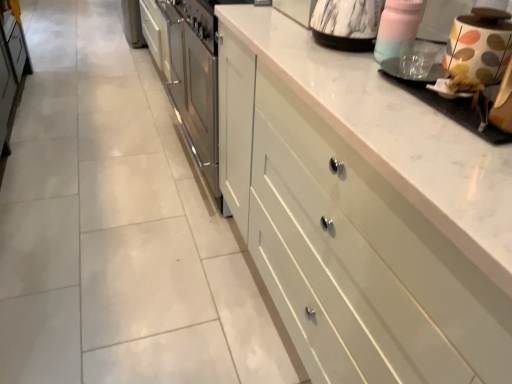
Image resolution: width=512 pixels, height=384 pixels. I want to click on vacant space to the left of white glossy coffee machine at upper right, so click(x=362, y=88).